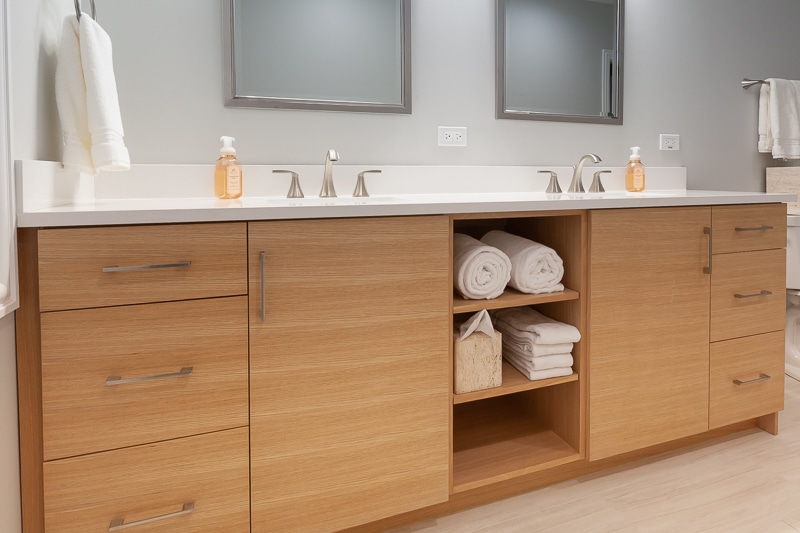
Locate an element on the screen. This screenshot has height=533, width=800. wall/door reflection (right mirror) is located at coordinates (569, 60), (604, 82).